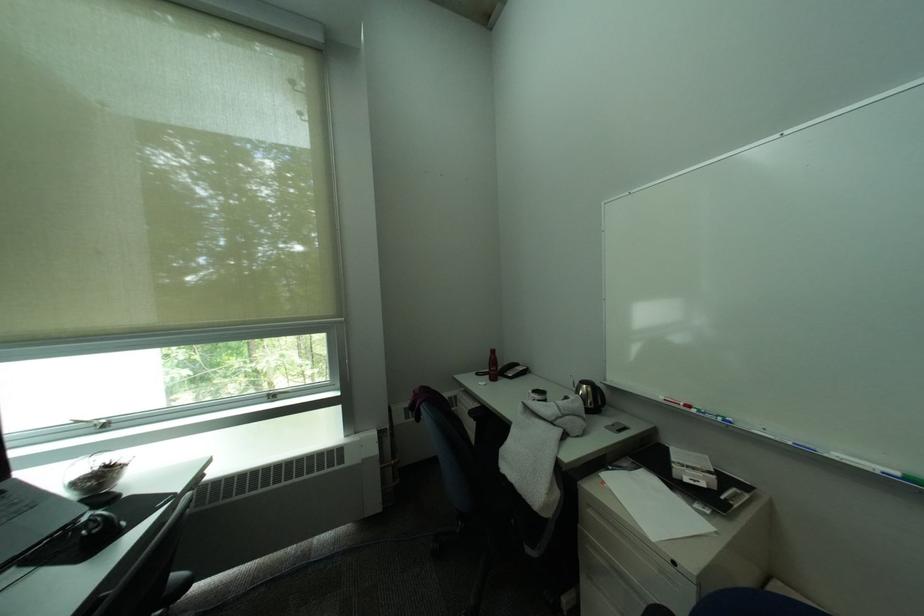
The width and height of the screenshot is (924, 616). What do you see at coordinates (625, 570) in the screenshot? I see `the cabinet drawer handle` at bounding box center [625, 570].